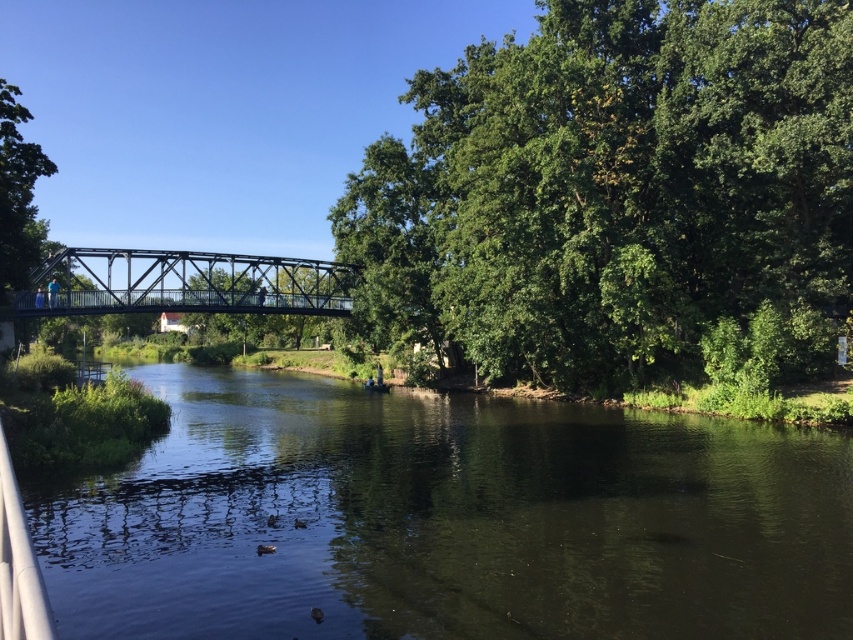
You are standing on the metal truss bridge and want to take a photo of both point (704, 444) and point (811, 6). Which point will appear larger in your photo?

Point (704, 444) will appear larger in the photo because it is closer to the camera than point (811, 6).

You are standing at the riverside and want to reach a specific location marked by the point at coordinates point (x=486, y=216). If you have a drone that can fly 150 feet, will it be able to reach that point from your current position?

The point (x=486, y=216) is 135.22 feet from the camera, so yes, the drone can reach it since its range is within the 150 feet limit.

Looking at this image, you are standing on the metal truss bridge and want to find the green leafy tree at center. According to the coordinates provided, where should you look relative to your position on the bridge?

The green leafy tree at center is located at coordinates point (613, 188), which means it is positioned to the left and slightly above your current position on the bridge.